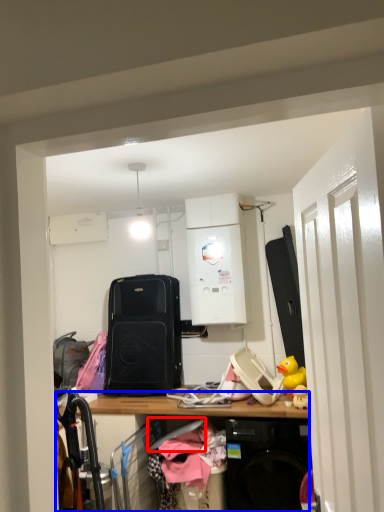
Question: Which object appears closest to the camera in this image, hanger (highlighted by a red box) or desk (highlighted by a blue box)?

Choices:
 (A) hanger
 (B) desk

Answer: (B)